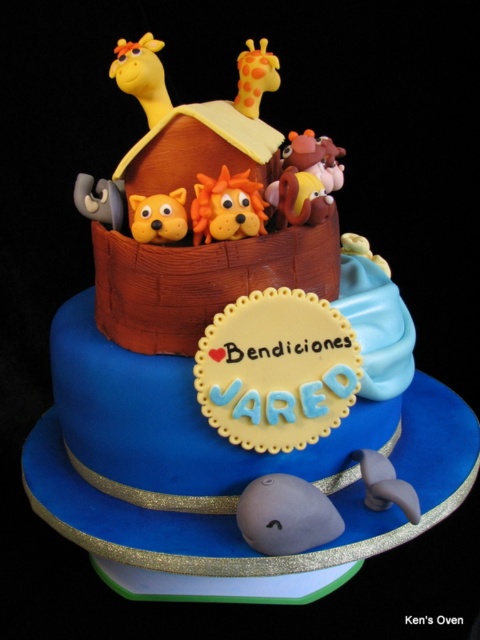
Between matte orange lion at center and matte orange giraffe at upper center, which one appears on the right side from the viewer's perspective?

Positioned to the right is matte orange giraffe at upper center.

Based on the photo, can you confirm if matte orange lion at center is smaller than matte orange giraffe at upper center?

Yes.

Does point (228, 177) lie in front of point (259, 48)?

Yes.

Where is `matte orange lion at center`? matte orange lion at center is located at coordinates (227, 208).

Does orange matte dog at center have a larger size compared to matte orange giraffe at upper center?

No.

Who is shorter, orange matte dog at center or matte orange giraffe at upper center?

With less height is orange matte dog at center.

Locate an element on the screen. This screenshot has height=640, width=480. orange matte dog at center is located at coordinates coord(158,216).

Is matte orange lion at center bigger than orange matte dog at center?

Correct, matte orange lion at center is larger in size than orange matte dog at center.

Who is taller, matte orange lion at center or orange matte dog at center?

matte orange lion at center is taller.

Identify the location of matte orange lion at center. This screenshot has width=480, height=640. point(227,208).